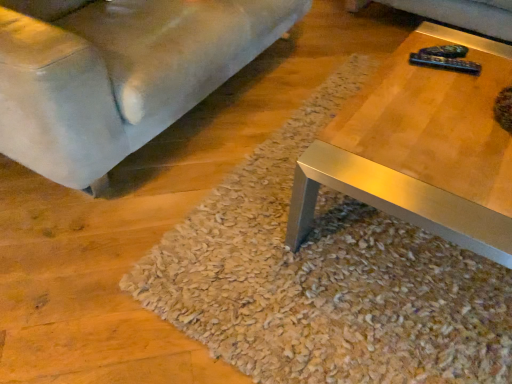
Question: In terms of size, does shaggy beige carpet at center appear bigger or smaller than suede-like gray couch at lower left?

Choices:
 (A) small
 (B) big

Answer: (A)

Question: From a real-world perspective, relative to suede-like gray couch at lower left, is shaggy beige carpet at center vertically above or below?

Choices:
 (A) above
 (B) below

Answer: (B)

Question: Does point (504, 375) appear closer or farther from the camera than point (90, 28)?

Choices:
 (A) farther
 (B) closer

Answer: (B)

Question: Is suede-like gray couch at lower left wider or thinner than shaggy beige carpet at center?

Choices:
 (A) thin
 (B) wide

Answer: (A)

Question: Considering the positions of suede-like gray couch at lower left and shaggy beige carpet at center in the image, is suede-like gray couch at lower left taller or shorter than shaggy beige carpet at center?

Choices:
 (A) short
 (B) tall

Answer: (B)

Question: Considering their positions, is suede-like gray couch at lower left located in front of or behind shaggy beige carpet at center?

Choices:
 (A) front
 (B) behind

Answer: (A)

Question: From a real-world perspective, is suede-like gray couch at lower left above or below shaggy beige carpet at center?

Choices:
 (A) below
 (B) above

Answer: (B)